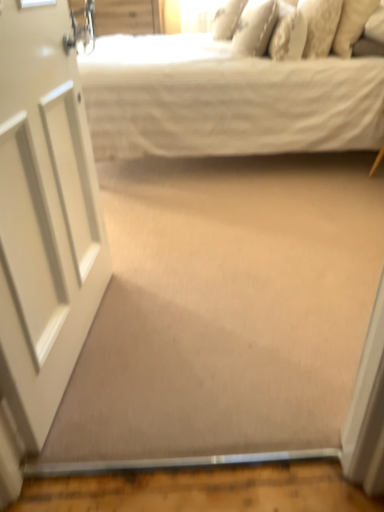
Question: Is white cotton bed at upper center next to white textured pillow at upper center, the 3th pillow positioned from the left?

Choices:
 (A) yes
 (B) no

Answer: (B)

Question: From a real-world perspective, is white cotton bed at upper center over white textured pillow at upper center, the 3th pillow positioned from the left?

Choices:
 (A) yes
 (B) no

Answer: (B)

Question: Considering the relative sizes of white cotton bed at upper center and white textured pillow at upper center, the 3th pillow positioned from the left, in the image provided, is white cotton bed at upper center shorter than white textured pillow at upper center, the 3th pillow positioned from the left,?

Choices:
 (A) yes
 (B) no

Answer: (B)

Question: From the image's perspective, does white cotton bed at upper center appear lower than white textured pillow at upper center, which is counted as the 3th pillow, starting from the right?

Choices:
 (A) yes
 (B) no

Answer: (A)

Question: Is white cotton bed at upper center turned away from white textured pillow at upper center, the 3th pillow positioned from the left?

Choices:
 (A) no
 (B) yes

Answer: (A)

Question: Based on their sizes in the image, would you say floral-patterned fabric pillow at upper right, the second pillow positioned from the right, is bigger or smaller than white textured pillow at upper right, acting as the fifth pillow starting from the left?

Choices:
 (A) big
 (B) small

Answer: (B)

Question: From a real-world perspective, is floral-patterned fabric pillow at upper right, arranged as the 4th pillow when viewed from the left, positioned above or below white textured pillow at upper right, which appears as the 1th pillow when viewed from the right?

Choices:
 (A) above
 (B) below

Answer: (A)

Question: Based on their positions, is floral-patterned fabric pillow at upper right, arranged as the 4th pillow when viewed from the left, located to the left or right of white textured pillow at upper right, acting as the fifth pillow starting from the left?

Choices:
 (A) left
 (B) right

Answer: (A)

Question: Considering the positions of point (339, 2) and point (344, 1), is point (339, 2) closer or farther from the camera than point (344, 1)?

Choices:
 (A) farther
 (B) closer

Answer: (A)

Question: Is point (243, 28) closer or farther from the camera than point (279, 24)?

Choices:
 (A) farther
 (B) closer

Answer: (A)

Question: Is white textured pillow at upper center, which is the 4th pillow from right to left, situated inside white textured pillow at upper center, the 3th pillow positioned from the left, or outside?

Choices:
 (A) inside
 (B) outside

Answer: (B)

Question: Is white textured pillow at upper center, positioned as the 2th pillow in left-to-right order, wider or thinner than white textured pillow at upper center, which is counted as the 3th pillow, starting from the right?

Choices:
 (A) wide
 (B) thin

Answer: (A)

Question: In terms of height, does white textured pillow at upper center, positioned as the 2th pillow in left-to-right order, look taller or shorter compared to white textured pillow at upper center, the 3th pillow positioned from the left?

Choices:
 (A) short
 (B) tall

Answer: (B)

Question: Which is correct: floral-patterned fabric pillow at upper right, arranged as the 4th pillow when viewed from the left, is inside white cotton bed at upper center, or outside of it?

Choices:
 (A) inside
 (B) outside

Answer: (A)

Question: From a real-world perspective, is floral-patterned fabric pillow at upper right, arranged as the 4th pillow when viewed from the left, above or below white cotton bed at upper center?

Choices:
 (A) below
 (B) above

Answer: (B)